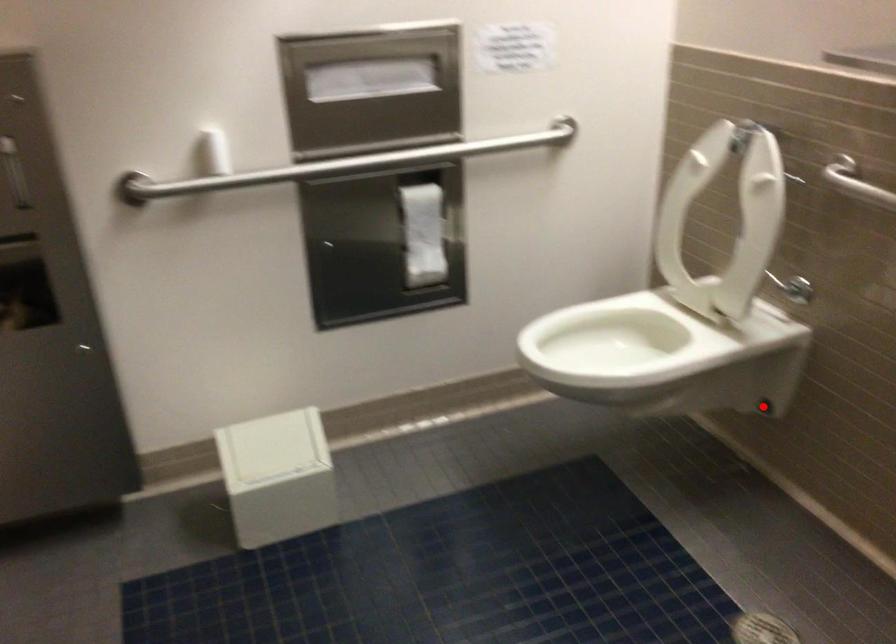
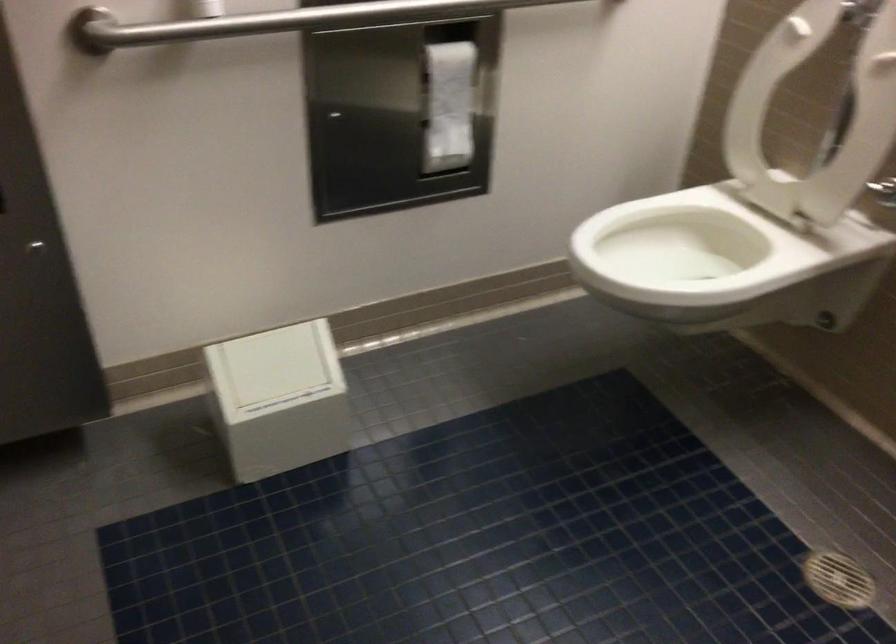
Question: I am providing you with two images of the same scene from different viewpoints. A red point is shown in image1. For the corresponding object point in image2, is it positioned nearer or farther from the camera?

Choices:
 (A) Nearer
 (B) Farther

Answer: (A)